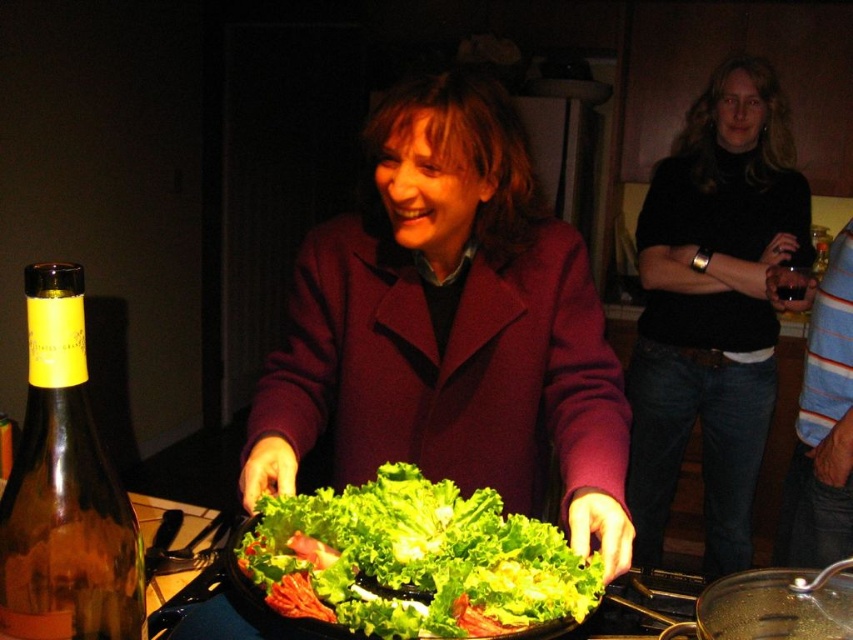
Question: Can you confirm if matte purple coat at center is wider than brown glass bottle at center?

Choices:
 (A) no
 (B) yes

Answer: (B)

Question: In this image, where is black turtleneck sweater at center located relative to transparent glass wok at lower right?

Choices:
 (A) right
 (B) left

Answer: (A)

Question: Is striped cotton shirt at lower right below brown glass bottle at center?

Choices:
 (A) no
 (B) yes

Answer: (B)

Question: Which object is the closest to the green leafy lettuce at center?

Choices:
 (A) brown glass bottle at center
 (B) amber glass bottle at left
 (C) matte purple coat at center

Answer: (C)

Question: Among these objects, which one is nearest to the camera?

Choices:
 (A) brown glass bottle at center
 (B) striped cotton shirt at lower right

Answer: (B)

Question: Which of these objects is positioned farthest from the amber glass bottle at left?

Choices:
 (A) green leafy lettuce at center
 (B) black turtleneck sweater at center
 (C) matte purple coat at center
 (D) transparent glass wok at lower right

Answer: (B)